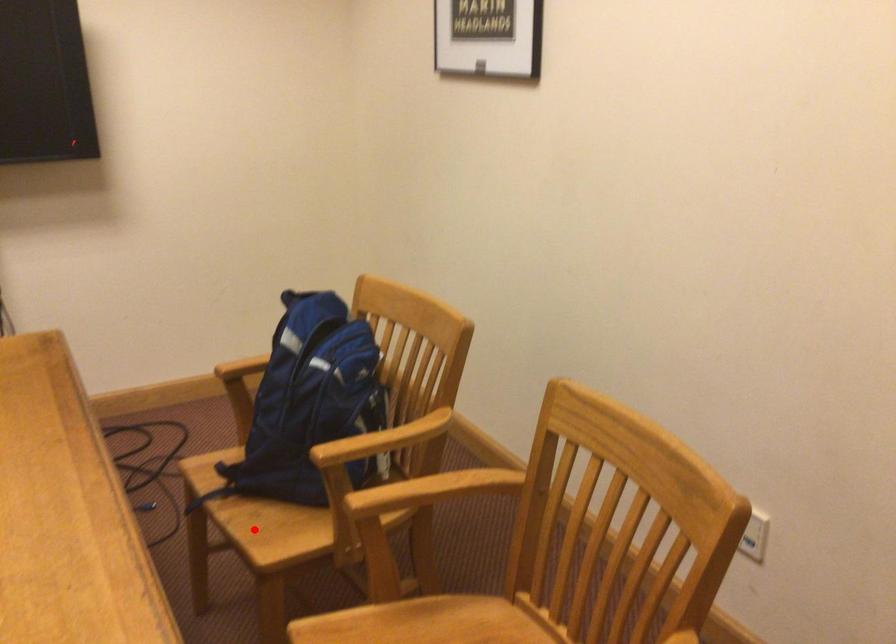
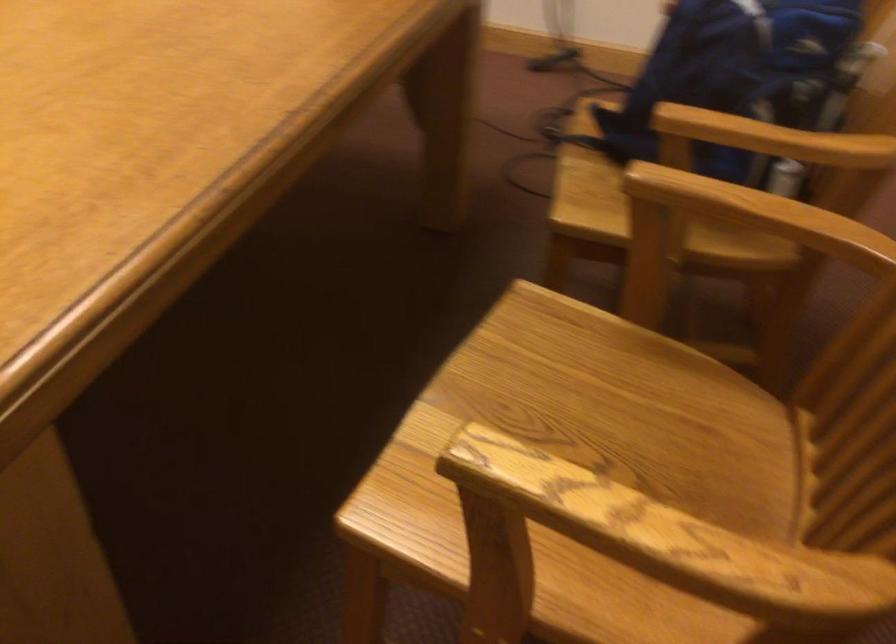
Question: I am providing you with two images of the same scene from different viewpoints. Given a red point in image1, look at the same physical point in image2. Is it:

Choices:
 (A) Closer to the viewpoint
 (B) Farther from the viewpoint

Answer: (A)